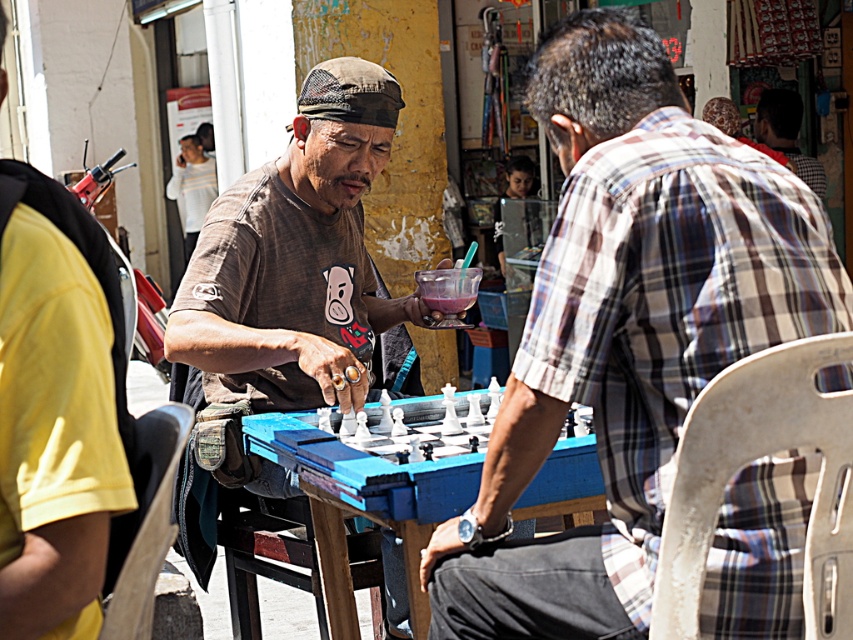
You are a photographer trying to capture a closeup of the plaid fabric shirt at center and the plaid shirt at upper right. Which one should you focus on first if you want to ensure both are in focus without moving the camera?

The plaid fabric shirt at center is located below plaid shirt at upper right, so you should focus on the plaid shirt at upper right first to ensure depth of field covers both.

You are a photographer trying to capture the chess game scene. You need to arrange the two people so that the plaid fabric shirt at center and the plaid shirt at upper right are visible in the frame. According to their positions, which one is located to the left of the other?

The plaid fabric shirt at center is positioned on the left side of plaid shirt at upper right, so the plaid fabric shirt at center is to the left of the plaid shirt at upper right.

You are a photographer trying to capture a candid shot of the chess players. You want to ensure the plaid fabric shirt at center and the blue plastic table at center are both in frame. Based on their positions, which object should you focus on first to ensure both are captured?

The plaid fabric shirt at center is to the right of the blue plastic table at center, so focusing on the blue plastic table at center first will ensure both objects are in frame as the shirt is positioned to its right.